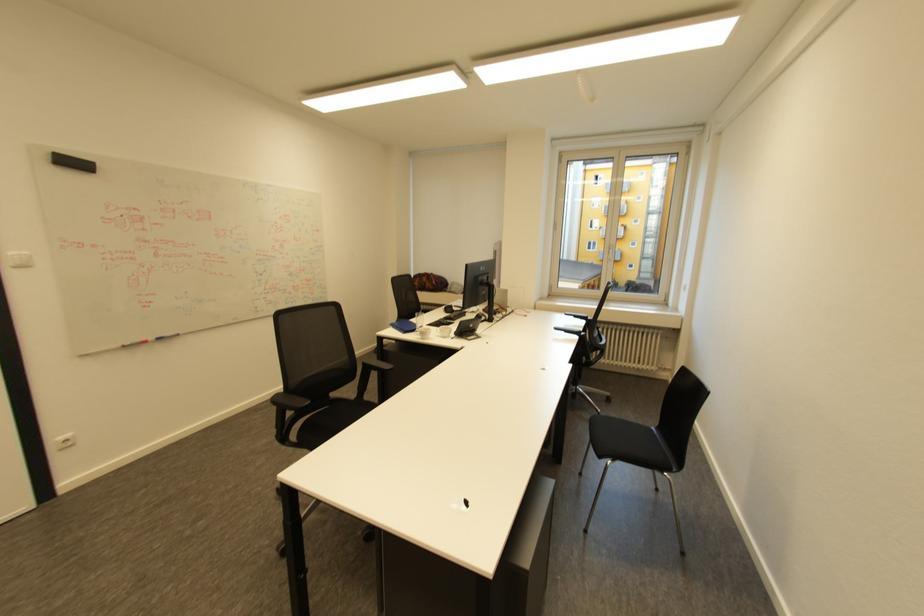
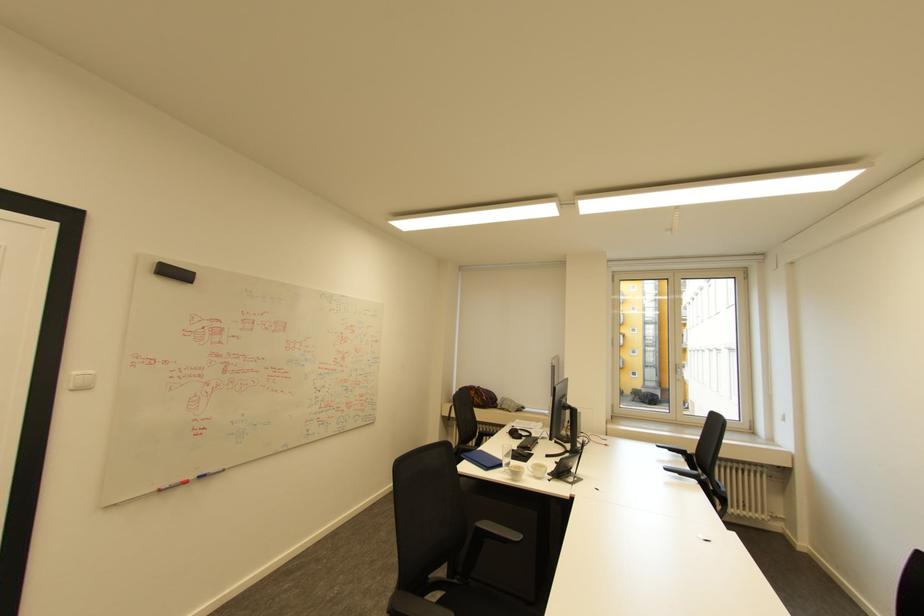
In the second image, find the point that corresponds to [128,346] in the first image.

(165, 490)